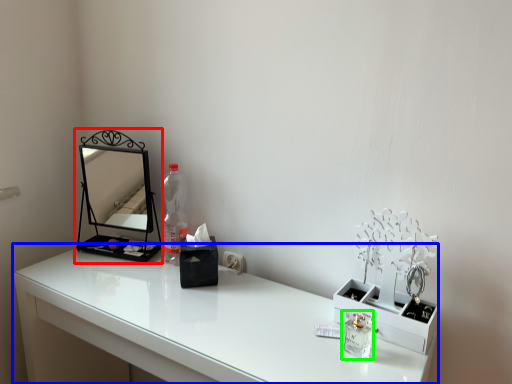
Question: Considering the real-world distances, which object is closest to medicine cabinet (highlighted by a red box)? table (highlighted by a blue box) or perfume (highlighted by a green box).

Choices:
 (A) table
 (B) perfume

Answer: (A)